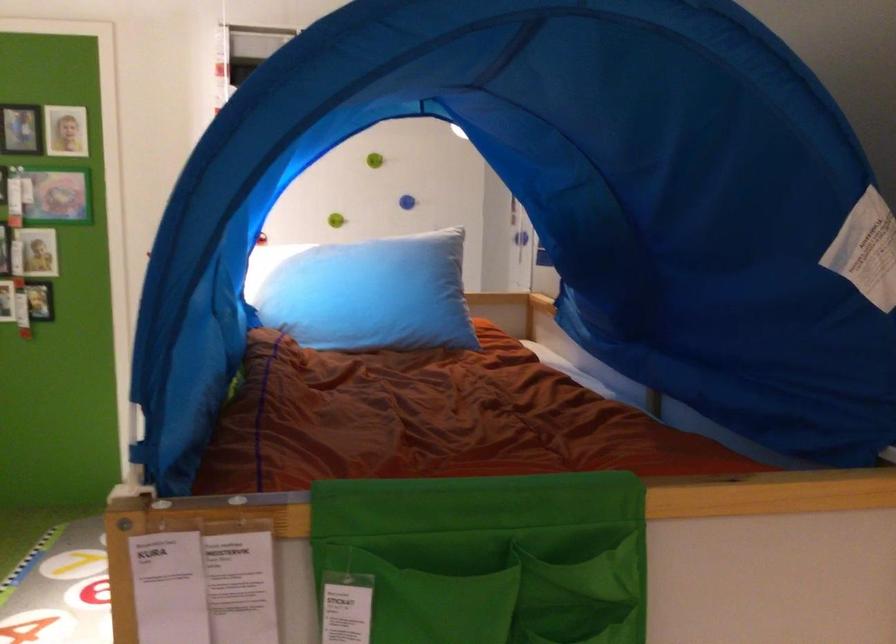
Where is `light blue pillow`? The height and width of the screenshot is (644, 896). light blue pillow is located at coordinates (366, 292).